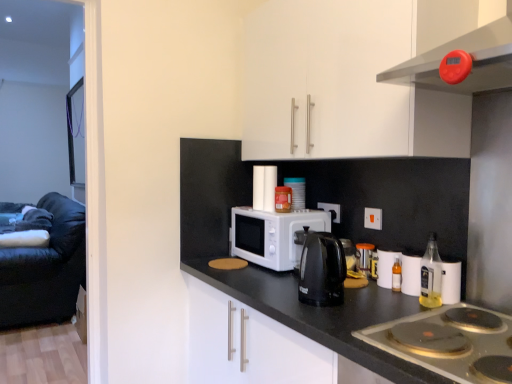
Find the location of a particular element. free space above black granite countertop at center (from a real-world perspective) is located at coordinates (343, 302).